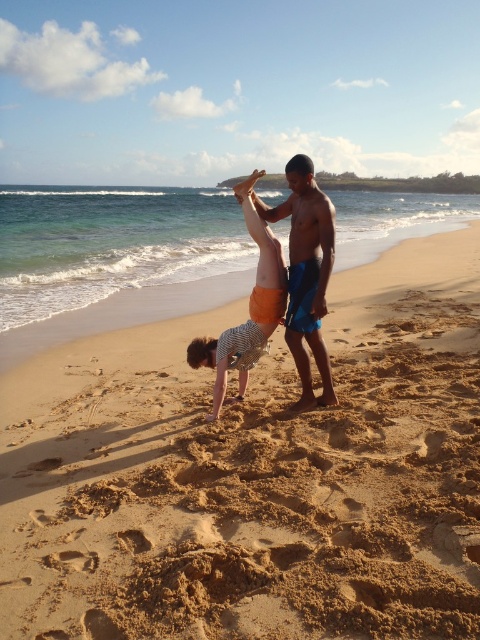
Does sandy yellow sand at center appear over orange shorts at center?

No, sandy yellow sand at center is not above orange shorts at center.

Who is more distant from viewer, [168,572] or [316,364]?

Positioned behind is point [316,364].

Locate an element on the screen. The width and height of the screenshot is (480, 640). sandy yellow sand at center is located at coordinates (254, 474).

Consider the image. Who is taller, sandy yellow sand at center or striped cotton shirt at center?

Standing taller between the two is striped cotton shirt at center.

Between point (168, 577) and point (242, 372), which one is positioned behind?

The point (242, 372) is behind.

Between point (39, 452) and point (225, 337), which one is positioned behind?

The point (225, 337) is behind.

This screenshot has height=640, width=480. Identify the location of sandy yellow sand at center. (254, 474).

Who is shorter, orange shorts at center or striped cotton shirt at center?

Standing shorter between the two is orange shorts at center.

Is orange shorts at center closer to camera compared to striped cotton shirt at center?

Yes, orange shorts at center is closer to the viewer.

Does point (320, 300) lie behind point (190, 342)?

No, it is not.

Image resolution: width=480 pixels, height=640 pixels. I want to click on orange shorts at center, so click(x=305, y=273).